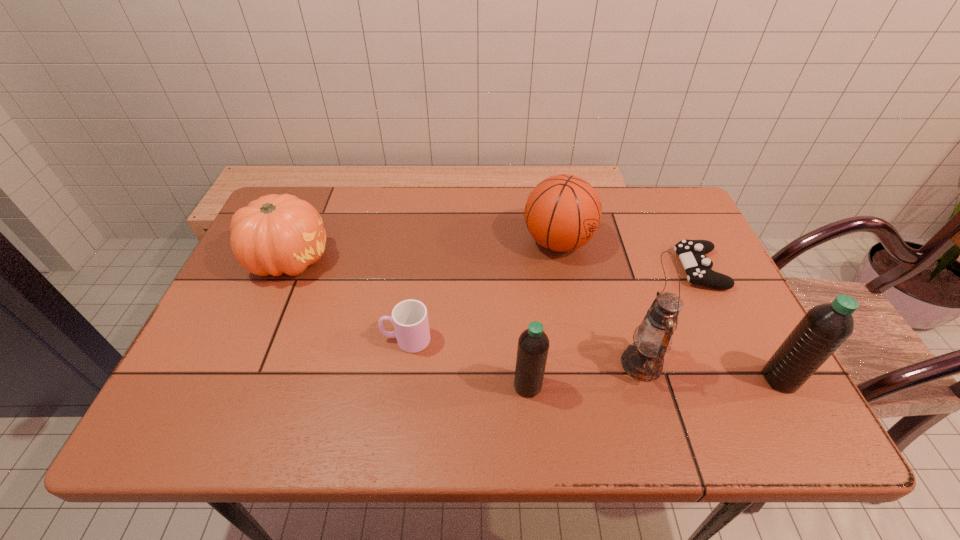
Please point a spot on the left to add another water bottle. Please provide its 2D coordinates. Your answer should be formatted as a tuple, i.e. [(x, y)], where the tuple contains the x and y coordinates of a point satisfying the conditions above.

[(269, 393)]